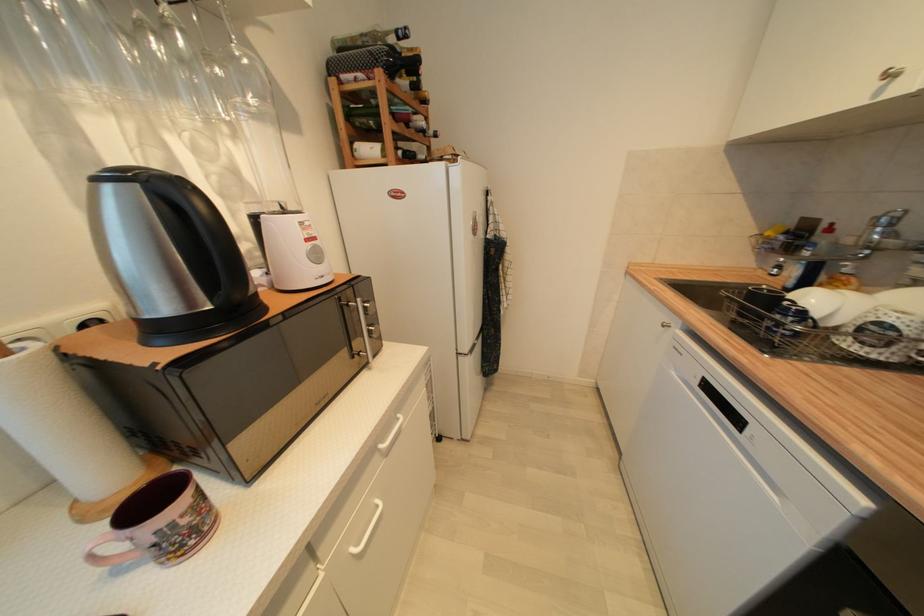
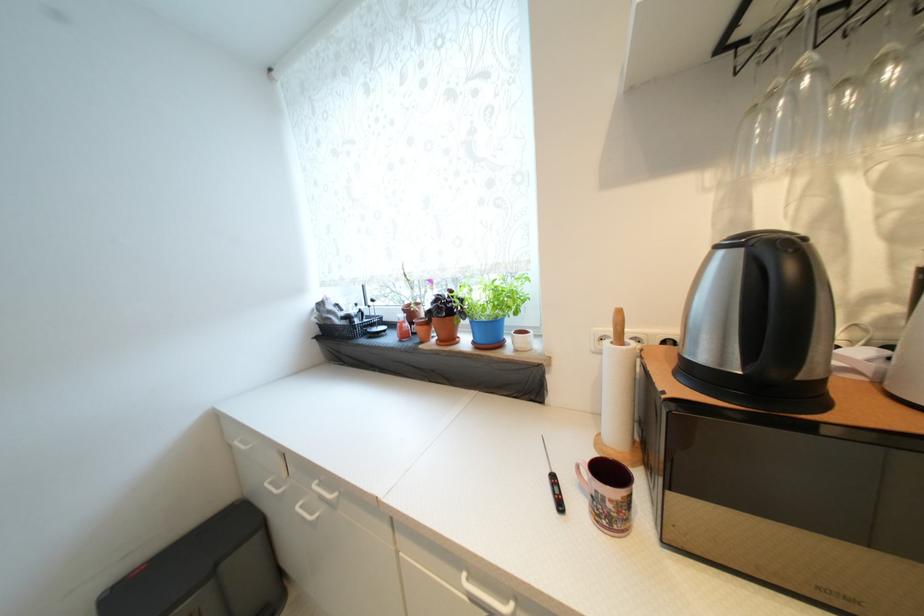
Where in the second image is the point corresponding to the point at 102,182 from the first image?

(723, 249)